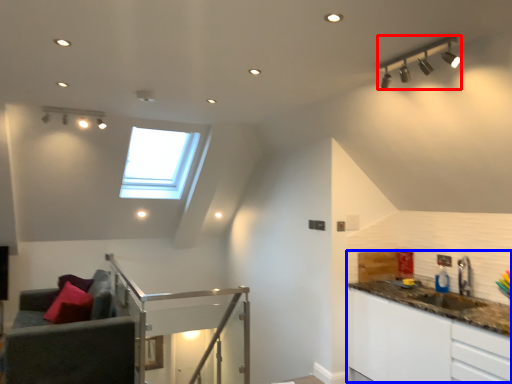
Question: Which object is closer to the camera taking this photo, light fixture (highlighted by a red box) or counter top (highlighted by a blue box)?

Choices:
 (A) light fixture
 (B) counter top

Answer: (A)